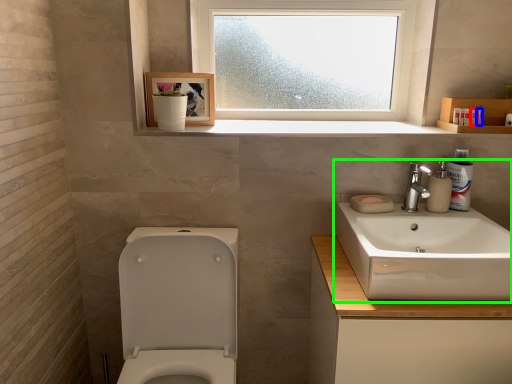
Question: Which object is positioned farthest from toiletry (highlighted by a red box)? Select from toiletry (highlighted by a blue box) and sink (highlighted by a green box).

Choices:
 (A) toiletry
 (B) sink

Answer: (B)